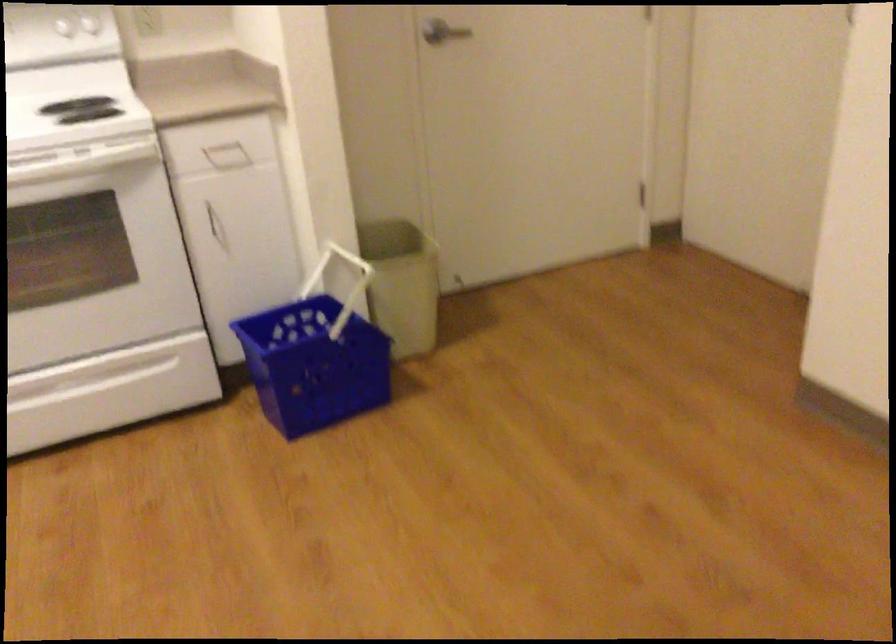
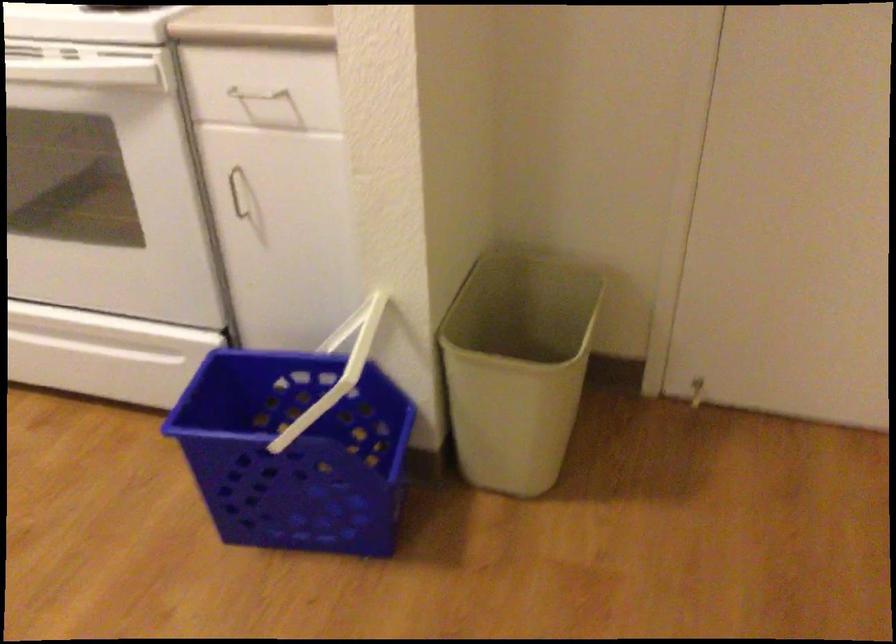
Locate, in the second image, the point that corresponds to point 311,275 in the first image.

(346, 328)